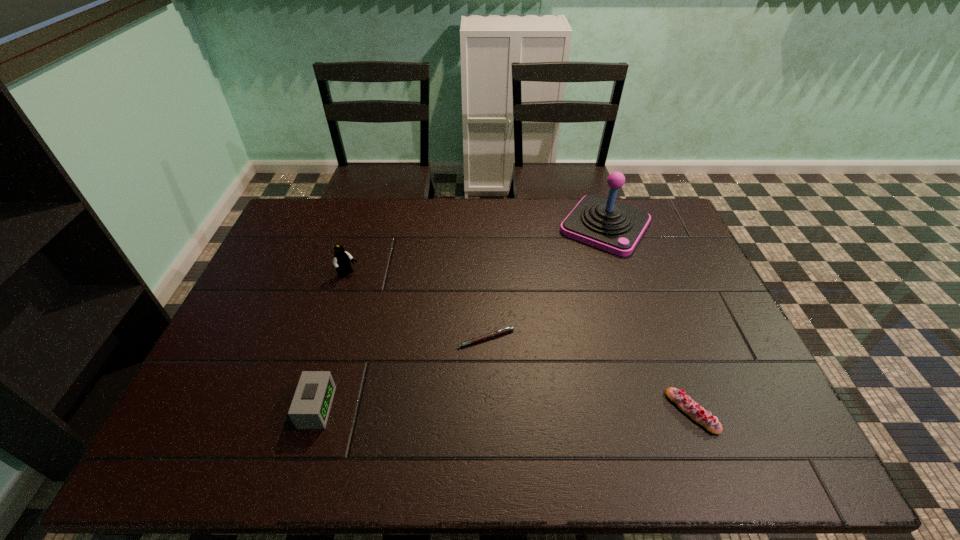
Image resolution: width=960 pixels, height=540 pixels. Identify the location of free space between the joystick and the fourth nearest object. click(x=476, y=251).

Select which object is the second closest to the eclair. Please provide its 2D coordinates. Your answer should be formatted as a tuple, i.e. [(x, y)], where the tuple contains the x and y coordinates of a point satisfying the conditions above.

[(603, 223)]

Select which object appears as the fourth closest to the pen. Please provide its 2D coordinates. Your answer should be formatted as a tuple, i.e. [(x, y)], where the tuple contains the x and y coordinates of a point satisfying the conditions above.

[(696, 412)]

Image resolution: width=960 pixels, height=540 pixels. In order to click on free space that satisfies the following two spatial constraints: 1. on the front side of the shortest object; 2. on the left side of the second farthest object in this screenshot , I will do `click(328, 338)`.

I want to click on blank area in the image that satisfies the following two spatial constraints: 1. on the front side of the third tallest object; 2. on the front-facing side of the fourth nearest object, so click(307, 408).

The height and width of the screenshot is (540, 960). Identify the location of free spot that satisfies the following two spatial constraints: 1. on the front side of the fourth shortest object; 2. on the front-facing side of the alarm clock. (307, 408).

The image size is (960, 540). I want to click on vacant area in the image that satisfies the following two spatial constraints: 1. on the front side of the second shortest object; 2. on the right side of the fourth shortest object, so click(305, 411).